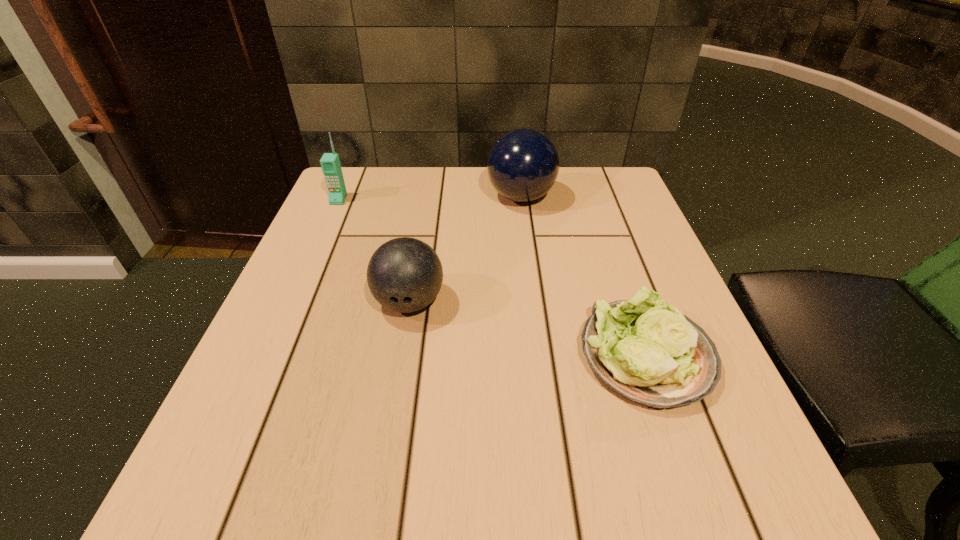
Find the location of `free space that satisfies the following two spatial constraints: 1. on the surface of the farther bowling ball near the finger holes; 2. on the right side of the lettuce`. free space that satisfies the following two spatial constraints: 1. on the surface of the farther bowling ball near the finger holes; 2. on the right side of the lettuce is located at coordinates (541, 356).

Where is `free location that satisfies the following two spatial constraints: 1. on the surface of the farther bowling ball near the finger holes; 2. on the left side of the lettuce`? The image size is (960, 540). free location that satisfies the following two spatial constraints: 1. on the surface of the farther bowling ball near the finger holes; 2. on the left side of the lettuce is located at coordinates (541, 356).

Where is `free space that satisfies the following two spatial constraints: 1. on the keypad of the leftmost object; 2. on the right side of the lettuce`? free space that satisfies the following two spatial constraints: 1. on the keypad of the leftmost object; 2. on the right side of the lettuce is located at coordinates (270, 356).

The height and width of the screenshot is (540, 960). Identify the location of vacant space that satisfies the following two spatial constraints: 1. on the keypad of the shortest object; 2. on the right side of the cellular telephone. (270, 356).

At what (x,y) coordinates should I click in order to perform the action: click on vacant space that satisfies the following two spatial constraints: 1. on the grip area of the shortest object; 2. on the left side of the left bowling ball. Please return your answer as a coordinate pair (x, y). Image resolution: width=960 pixels, height=540 pixels. Looking at the image, I should click on (400, 356).